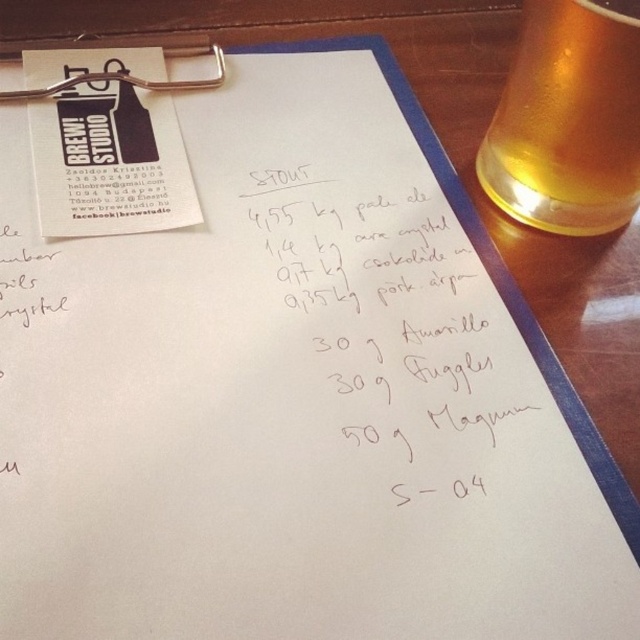
Is black paper at center to the right of translucent glass beer at upper right from the viewer's perspective?

No, black paper at center is not to the right of translucent glass beer at upper right.

Between point (456, 198) and point (625, 156), which one is positioned behind?

Positioned behind is point (456, 198).

The height and width of the screenshot is (640, 640). Identify the location of black paper at center. (397, 316).